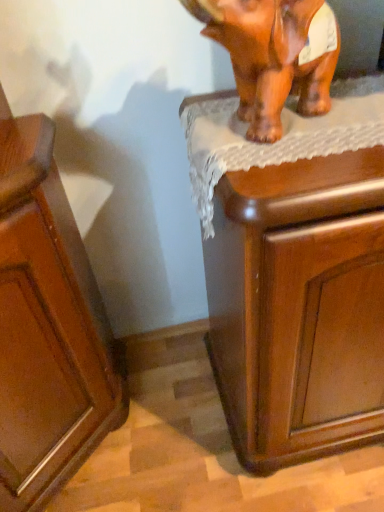
Question: Does brown glossy elephant at upper right lie in front of glossy wood cabinet at lower left?

Choices:
 (A) no
 (B) yes

Answer: (A)

Question: Is brown glossy elephant at upper right thinner than glossy wood cabinet at lower left?

Choices:
 (A) no
 (B) yes

Answer: (B)

Question: Does brown glossy elephant at upper right appear on the left side of glossy wood cabinet at lower left?

Choices:
 (A) no
 (B) yes

Answer: (A)

Question: From a real-world perspective, is brown glossy elephant at upper right located beneath glossy wood cabinet at lower left?

Choices:
 (A) no
 (B) yes

Answer: (A)

Question: Is brown glossy elephant at upper right wider than glossy wood cabinet at lower left?

Choices:
 (A) yes
 (B) no

Answer: (B)

Question: From their relative heights in the image, would you say glossy wood cabinet at lower left is taller or shorter than brown glossy elephant at upper right?

Choices:
 (A) tall
 (B) short

Answer: (A)

Question: Would you say glossy wood cabinet at lower left is inside or outside brown glossy elephant at upper right?

Choices:
 (A) outside
 (B) inside

Answer: (A)

Question: Considering their positions, is glossy wood cabinet at lower left located in front of or behind brown glossy elephant at upper right?

Choices:
 (A) front
 (B) behind

Answer: (A)

Question: In terms of width, does glossy wood cabinet at lower left look wider or thinner when compared to brown glossy elephant at upper right?

Choices:
 (A) thin
 (B) wide

Answer: (B)

Question: In terms of size, does brown glossy elephant at upper right appear bigger or smaller than wooden cabinet at upper right?

Choices:
 (A) big
 (B) small

Answer: (B)

Question: Is brown glossy elephant at upper right inside the boundaries of wooden cabinet at upper right, or outside?

Choices:
 (A) outside
 (B) inside

Answer: (A)

Question: Is brown glossy elephant at upper right wider or thinner than wooden cabinet at upper right?

Choices:
 (A) wide
 (B) thin

Answer: (B)

Question: Is brown glossy elephant at upper right taller or shorter than wooden cabinet at upper right?

Choices:
 (A) tall
 (B) short

Answer: (B)

Question: Considering the positions of point (309, 236) and point (92, 304), is point (309, 236) closer or farther from the camera than point (92, 304)?

Choices:
 (A) closer
 (B) farther

Answer: (A)

Question: Is wooden cabinet at upper right spatially inside glossy wood cabinet at lower left, or outside of it?

Choices:
 (A) outside
 (B) inside

Answer: (A)